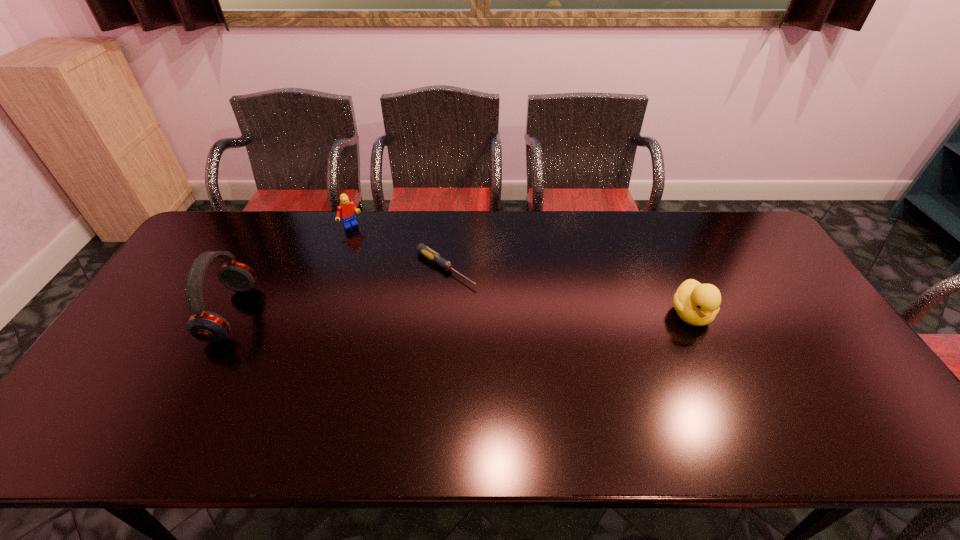
Where is `the tallest object`? the tallest object is located at coordinates (206, 326).

This screenshot has width=960, height=540. In order to click on earphone in this screenshot , I will do `click(206, 326)`.

This screenshot has height=540, width=960. In order to click on duck in this screenshot , I will do `click(697, 304)`.

Image resolution: width=960 pixels, height=540 pixels. Identify the location of the second object from right to left. (422, 249).

You are a GUI agent. You are given a task and a screenshot of the screen. Output one action in this format:
    pyautogui.click(x=<x>, y=<y>)
    Task: Click on the screwdriver
    
    Given the screenshot: What is the action you would take?
    pyautogui.click(x=422, y=249)

At what (x,y) coordinates should I click in order to perform the action: click on the farthest object. Please return your answer as a coordinate pair (x, y). This screenshot has width=960, height=540. Looking at the image, I should click on (346, 209).

Where is `the second object from left to right`? The image size is (960, 540). the second object from left to right is located at coordinates (346, 209).

This screenshot has height=540, width=960. I want to click on vacant space located 0.120m on the ear cups of the leftmost object, so click(291, 313).

You are a GUI agent. You are given a task and a screenshot of the screen. Output one action in this format:
    pyautogui.click(x=<x>, y=<y>)
    Task: Click on the vacant space located 0.160m on the front-facing side of the rightmost object
    The width and height of the screenshot is (960, 540).
    Given the screenshot: What is the action you would take?
    [x=723, y=386]

Locate an element on the screen. free location located insert the screwdriver into a screw head is located at coordinates (505, 307).